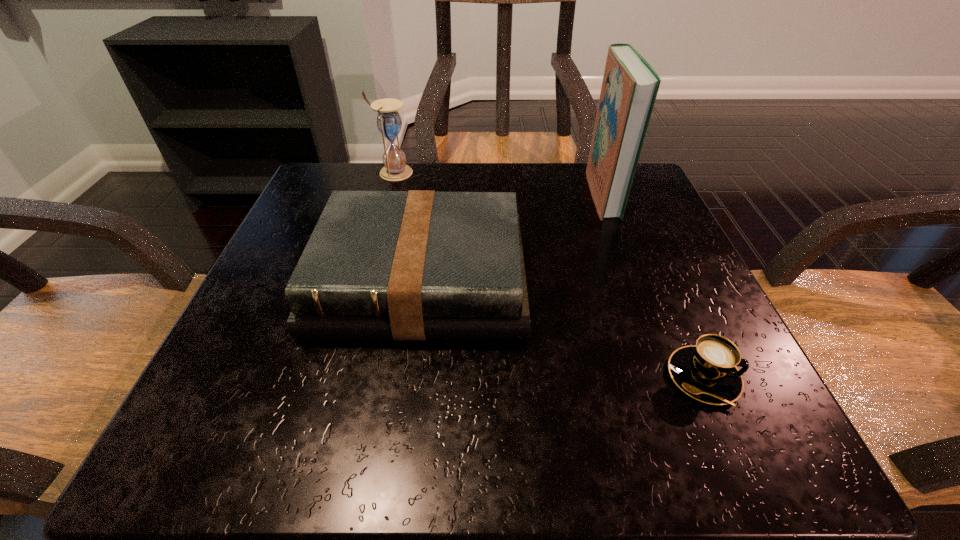
What are the coordinates of `object that is the third closest to the nearer hardback book` in the screenshot? It's located at (707, 372).

You are a GUI agent. You are given a task and a screenshot of the screen. Output one action in this format:
    pyautogui.click(x=<x>, y=<y>)
    Task: Click on the free space that satisfies the following two spatial constraints: 1. on the spine side of the cappuccino; 2. on the right side of the second nearest object
    The width and height of the screenshot is (960, 540).
    Given the screenshot: What is the action you would take?
    pyautogui.click(x=406, y=377)

The width and height of the screenshot is (960, 540). Identify the location of free location that satisfies the following two spatial constraints: 1. on the cover of the cappuccino; 2. on the left side of the taller hardback book. (671, 377).

The height and width of the screenshot is (540, 960). Find the location of `vacant region that satisfies the following two spatial constraints: 1. on the cover of the shortest object; 2. on the right side of the taller hardback book`. vacant region that satisfies the following two spatial constraints: 1. on the cover of the shortest object; 2. on the right side of the taller hardback book is located at coordinates (671, 377).

At what (x,y) coordinates should I click in order to perform the action: click on vacant space that satisfies the following two spatial constraints: 1. on the cover of the tallest object; 2. on the left side of the cappuccino. Please return your answer as a coordinate pair (x, y). Looking at the image, I should click on (671, 377).

Find the location of a particular element. The width and height of the screenshot is (960, 540). free space that satisfies the following two spatial constraints: 1. on the cover of the taller hardback book; 2. on the right side of the nearest object is located at coordinates (671, 377).

Where is `free location that satisfies the following two spatial constraints: 1. on the cover of the right hardback book; 2. on the spine side of the second shortest object`? The height and width of the screenshot is (540, 960). free location that satisfies the following two spatial constraints: 1. on the cover of the right hardback book; 2. on the spine side of the second shortest object is located at coordinates (635, 280).